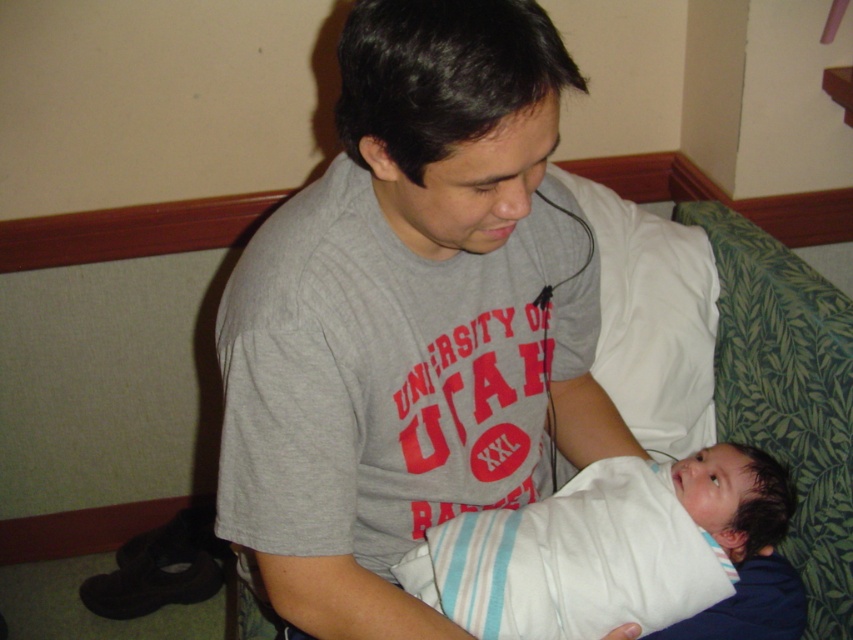
Is point (379, 68) closer to viewer compared to point (688, 572)?

Yes, it is in front of point (688, 572).

Is point (271, 404) farther from camera compared to point (569, 528)?

No.

The width and height of the screenshot is (853, 640). What are the coordinates of `gray cotton t-shirt at center` in the screenshot? It's located at (409, 317).